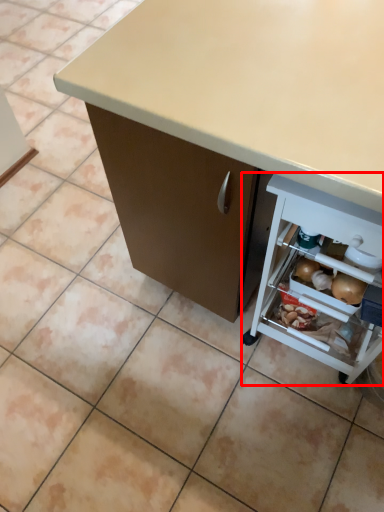
Question: From the image's perspective, considering the relative positions of shelf (annotated by the red box) and desk in the image provided, where is shelf (annotated by the red box) located with respect to the staircase?

Choices:
 (A) below
 (B) above

Answer: (A)